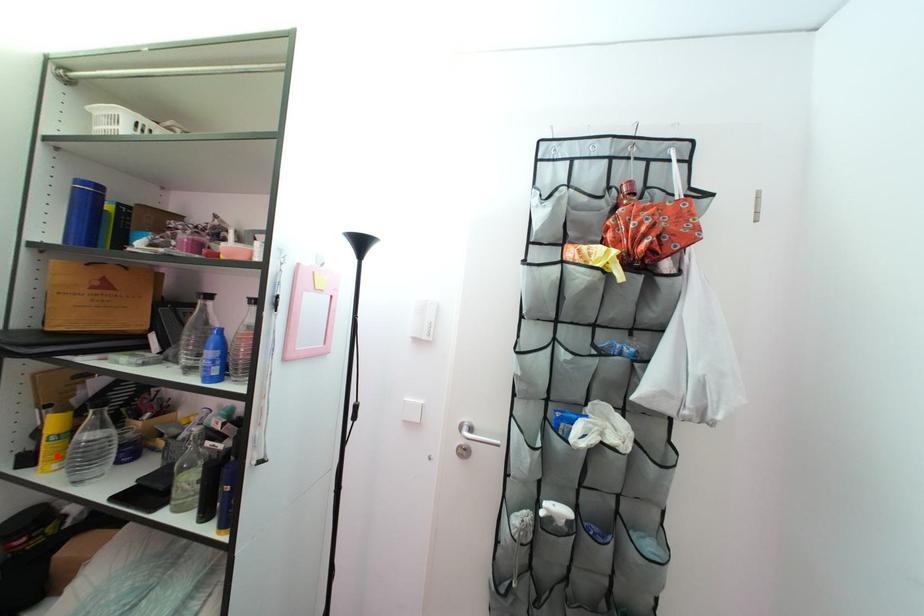
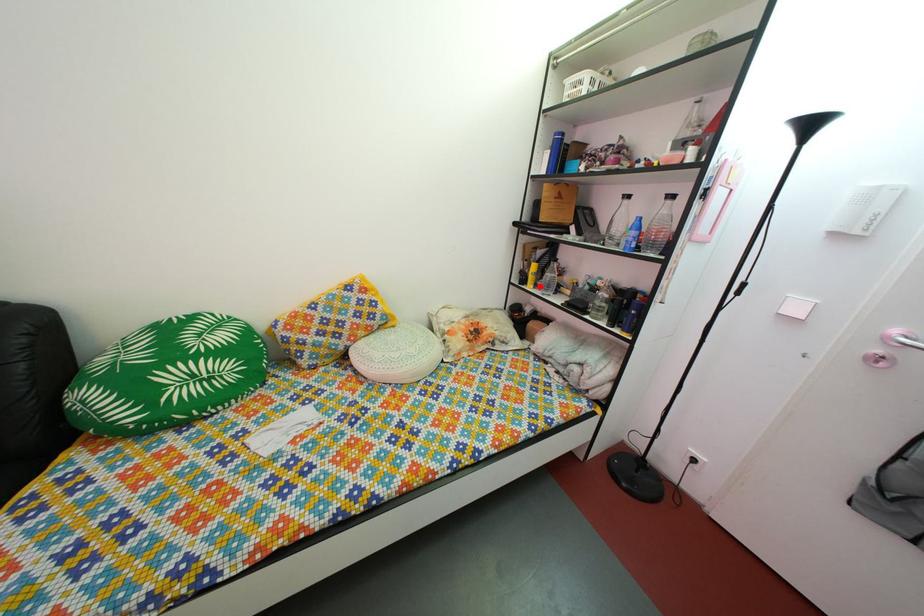
I am providing you with two images of the same scene from different viewpoints. A red point is marked on the first image and another point is marked on the second image. Are the points marked in image1 and image2 representing the same 3D position?

Yes